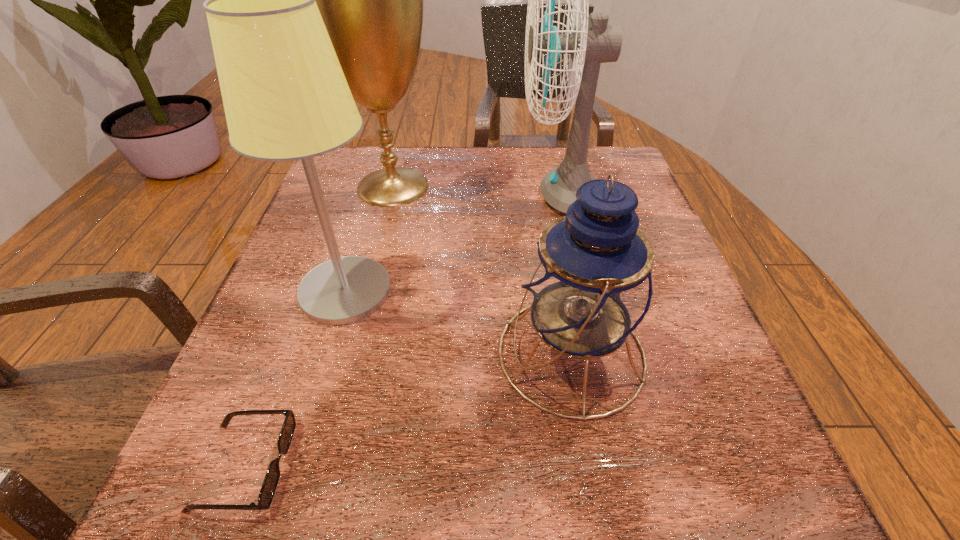
The width and height of the screenshot is (960, 540). I want to click on fan, so click(x=590, y=43).

I want to click on table lamp, so click(285, 96).

Where is `trophy cup`? trophy cup is located at coordinates (371, 0).

You are a GUI agent. You are given a task and a screenshot of the screen. Output one action in this format:
    pyautogui.click(x=<x>, y=<y>)
    Task: Click on the lantern
    
    Given the screenshot: What is the action you would take?
    pyautogui.click(x=588, y=285)

The height and width of the screenshot is (540, 960). In order to click on sunglasses in this screenshot , I will do [x=272, y=476].

Find the location of a particular element. Image resolution: width=960 pixels, height=540 pixels. vacant space located on the front-facing side of the fan is located at coordinates (397, 195).

Find the location of `vacant area situated on the front-facing side of the fan`. vacant area situated on the front-facing side of the fan is located at coordinates (492, 195).

The image size is (960, 540). In order to click on vacant space located on the front-facing side of the fan in this screenshot , I will do pyautogui.click(x=363, y=195).

Locate an element on the screen. The image size is (960, 540). vacant space located 0.310m on the back of the table lamp is located at coordinates (381, 175).

I want to click on free region located 0.080m on the back of the trophy cup, so click(403, 148).